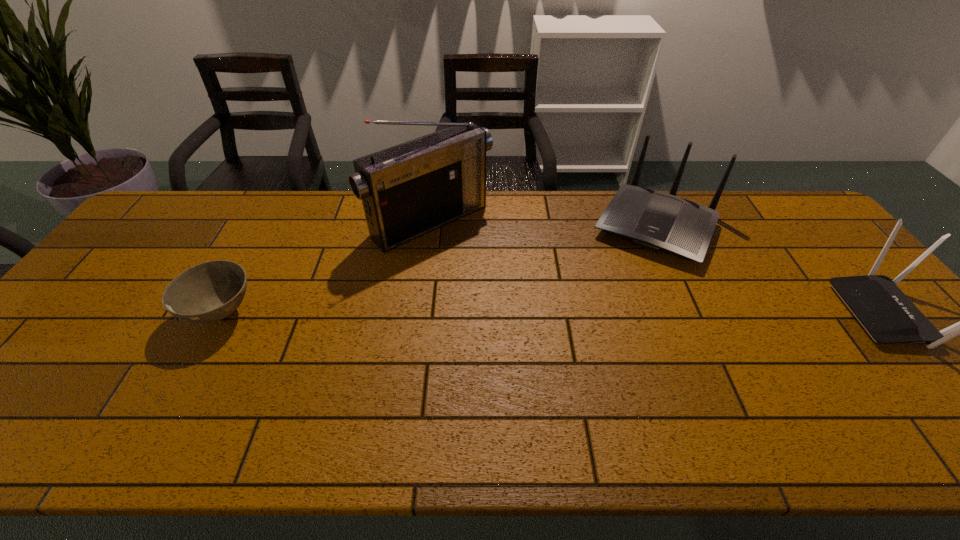
In order to click on vacant spot on the desktop that is between the bowl and the second shortest object and is positioned on the front-facing side of the tallest object in this screenshot , I will do `click(530, 313)`.

This screenshot has width=960, height=540. Identify the location of free space on the desktop that is between the leftmost object and the second shortest object and is positioned on the front-facing side of the taller router. (611, 313).